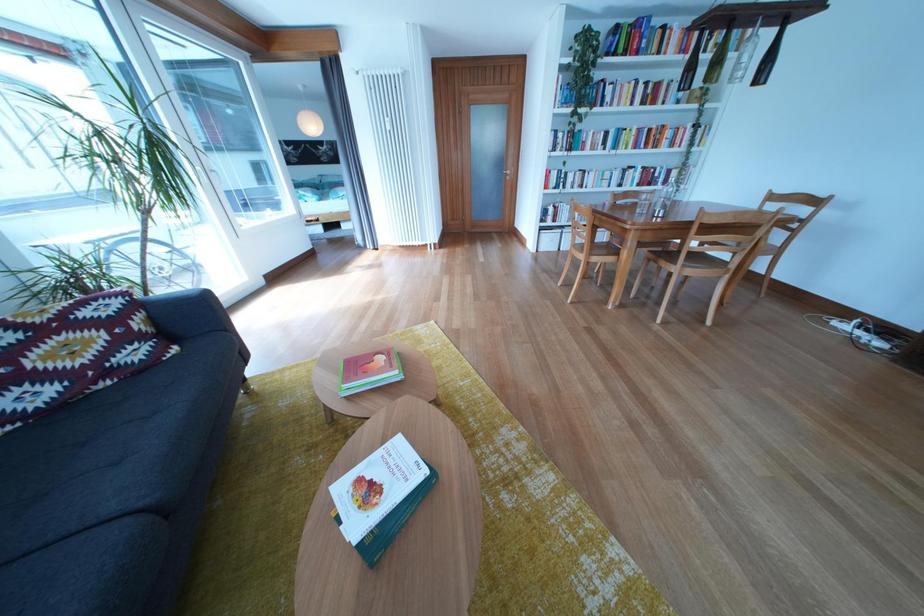
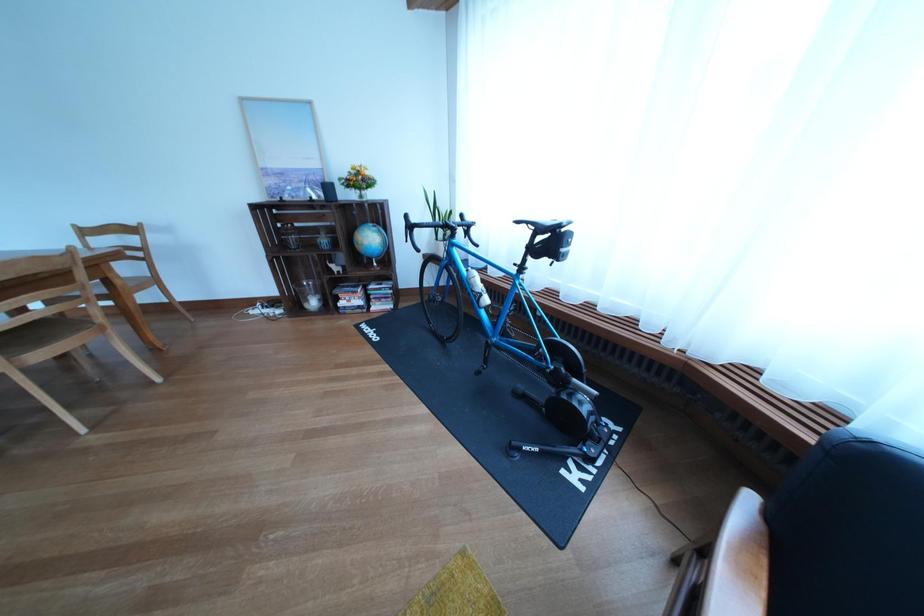
Locate, in the second image, the point that corresponds to the point at 791,241 in the first image.

(141, 276)